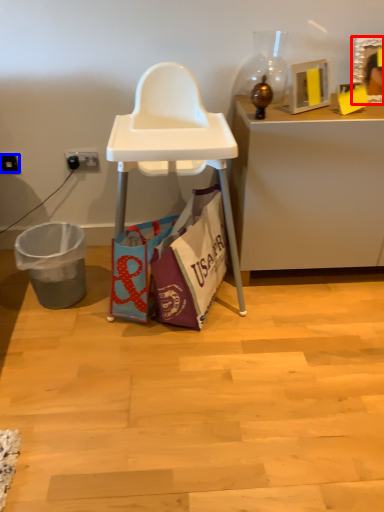
Question: Which object is closer to the camera taking this photo, picture frame (highlighted by a red box) or power outlet (highlighted by a blue box)?

Choices:
 (A) picture frame
 (B) power outlet

Answer: (A)